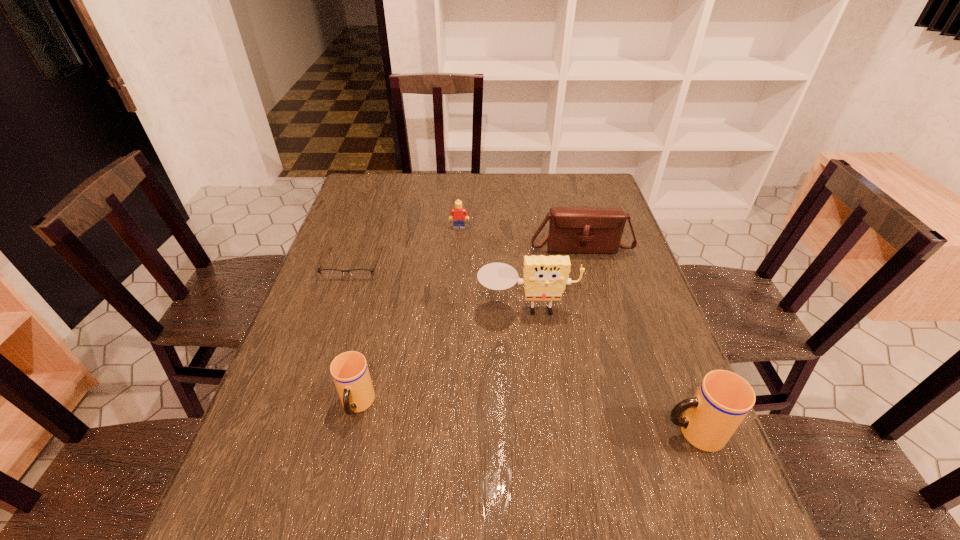
This screenshot has width=960, height=540. What are the coordinates of `free spot located 0.270m on the front-facing side of the Lego` in the screenshot? It's located at (456, 288).

The width and height of the screenshot is (960, 540). Identify the location of vacant area situated 0.110m on the front flap of the shoulder bag. (590, 282).

At what (x,y) coordinates should I click in order to perform the action: click on vacant space located 0.270m on the front-facing side of the spectacles. Please return your answer as a coordinate pair (x, y). Image resolution: width=960 pixels, height=540 pixels. Looking at the image, I should click on (322, 357).

I want to click on free space located 0.290m on the front-facing side of the fourth farthest object, so click(x=540, y=429).

Find the location of a particular element. The width and height of the screenshot is (960, 540). object present at the near edge is located at coordinates (723, 399).

Identify the location of object situated at the left edge. The height and width of the screenshot is (540, 960). coord(326,273).

This screenshot has height=540, width=960. Identify the location of cup present at the right edge. (723, 399).

Find the location of a particular element. The width and height of the screenshot is (960, 540). shoulder bag situated at the right edge is located at coordinates (572, 230).

Find the location of a particular element. object at the near right corner is located at coordinates (723, 399).

Where is `free space at the far edge of the desktop`? This screenshot has width=960, height=540. free space at the far edge of the desktop is located at coordinates (544, 201).